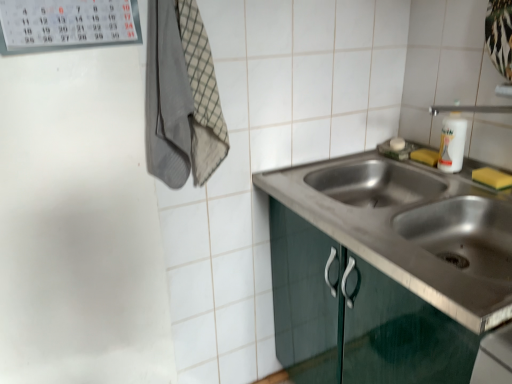
I want to click on vacant point to the left of yellow sponge at right, arranged as the first soap when viewed from the right, so click(x=454, y=191).